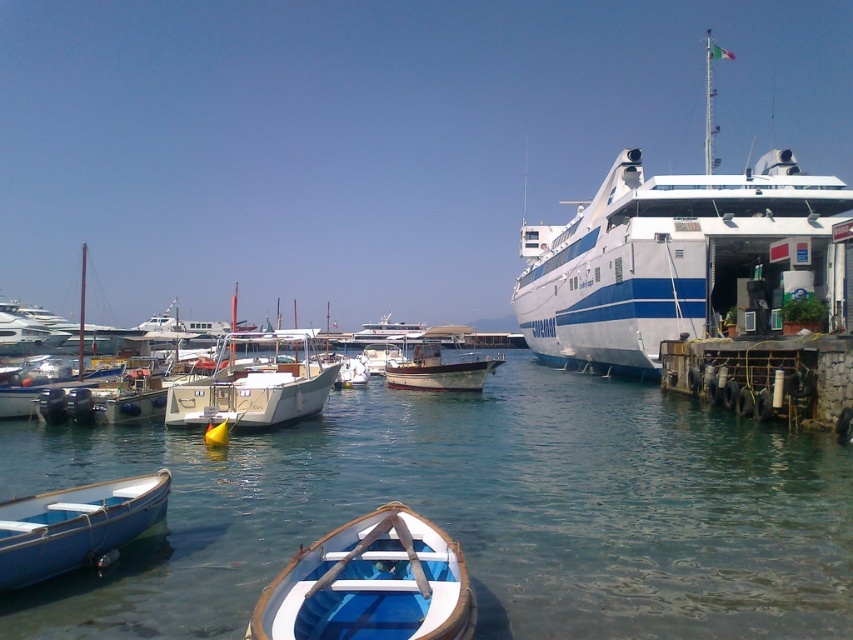
Who is higher up, clear blue water at center or blue painted wood boat at lower left?

blue painted wood boat at lower left is above.

Which is more to the right, clear blue water at center or blue painted wood boat at lower left?

clear blue water at center is more to the right.

Is point (645, 477) positioned after point (158, 516)?

Yes.

Find the location of a particular element. The image size is (853, 640). clear blue water at center is located at coordinates (474, 512).

Who is more distant from viewer, (552,602) or (375,522)?

Positioned behind is point (552,602).

Between point (659, 600) and point (282, 582), which one is positioned in front?

Positioned in front is point (282, 582).

Between point (434, 452) and point (341, 525), which one is positioned in front?

Positioned in front is point (341, 525).

The height and width of the screenshot is (640, 853). I want to click on clear blue water at center, so click(474, 512).

Does blue wooden boat at center have a greater height compared to blue painted wood boat at lower left?

No, blue wooden boat at center is not taller than blue painted wood boat at lower left.

Can you confirm if blue wooden boat at center is positioned above blue painted wood boat at lower left?

Yes.

Which is in front, point (328, 637) or point (119, 545)?

Point (328, 637) is in front.

Where is `blue wooden boat at center`? This screenshot has height=640, width=853. blue wooden boat at center is located at coordinates (370, 584).